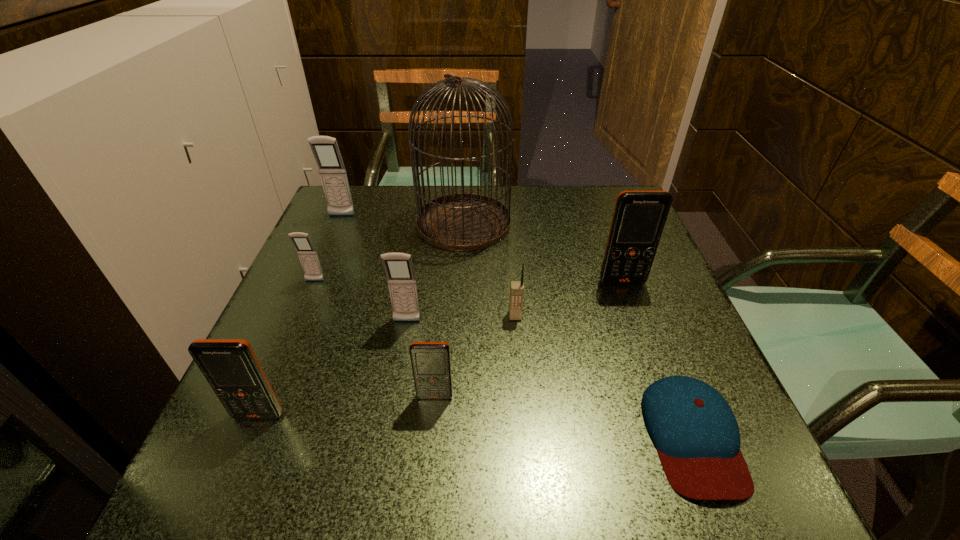
This screenshot has width=960, height=540. Identify the location of blank space located on the screen of the fifth cellular telephone from left to right. (432, 428).

You are a GUI agent. You are given a task and a screenshot of the screen. Output one action in this format:
    pyautogui.click(x=<x>, y=<y>)
    Task: Click on the free space located 0.200m on the front-facing side of the second nearest gray cellular telephone
    
    Given the screenshot: What is the action you would take?
    pyautogui.click(x=282, y=356)

Locate an element on the screen. The height and width of the screenshot is (540, 960). birdcage that is positioned at the far edge is located at coordinates (458, 222).

The height and width of the screenshot is (540, 960). I want to click on cellular telephone at the far edge, so click(x=325, y=149).

Find the location of `object located in the near edge section of the desktop`. object located in the near edge section of the desktop is located at coordinates click(x=697, y=437).

This screenshot has width=960, height=540. I want to click on cellular telephone that is at the right edge, so click(x=639, y=217).

Image resolution: width=960 pixels, height=540 pixels. What are the coordinates of `baseball cap that is at the right edge` in the screenshot? It's located at (697, 437).

At what (x,y) coordinates should I click in order to perform the action: click on object present at the far left corner. Please return your answer as a coordinate pair (x, y). Looking at the image, I should click on coord(325,149).

What are the coordinates of `object that is at the near right corner` in the screenshot? It's located at (697, 437).

Identify the location of free space at the far edge. Image resolution: width=960 pixels, height=540 pixels. (389, 205).